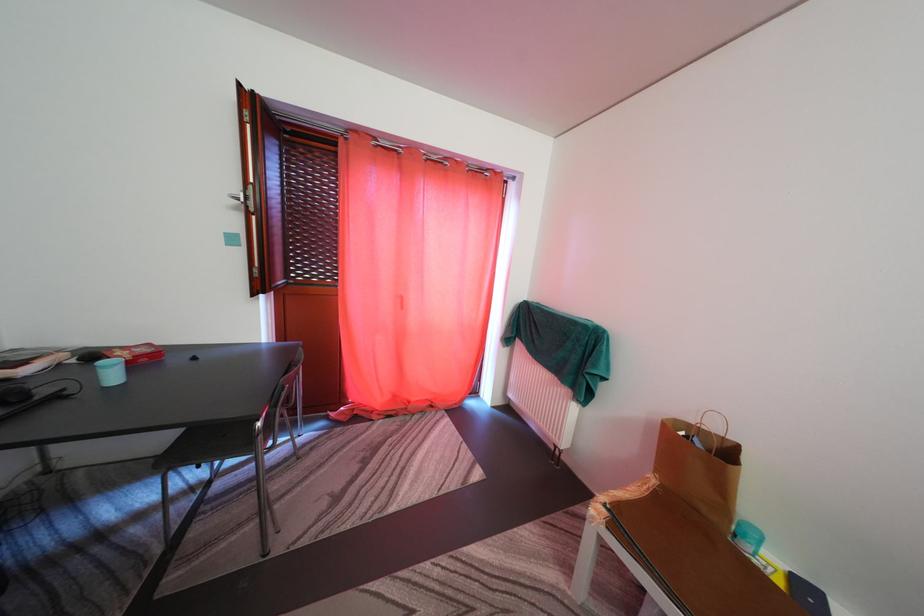
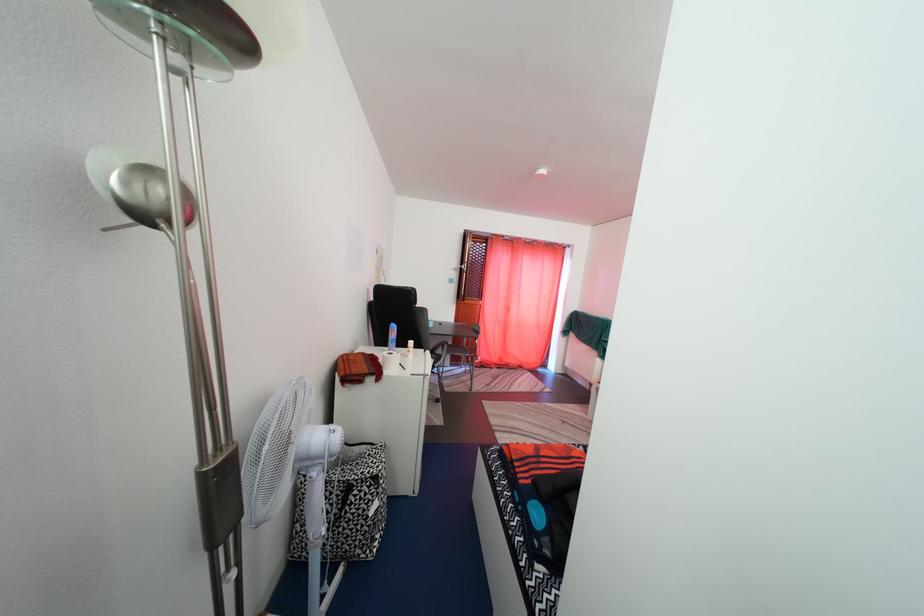
Locate, in the second image, the point that corresponds to [409,309] in the first image.

(517, 315)